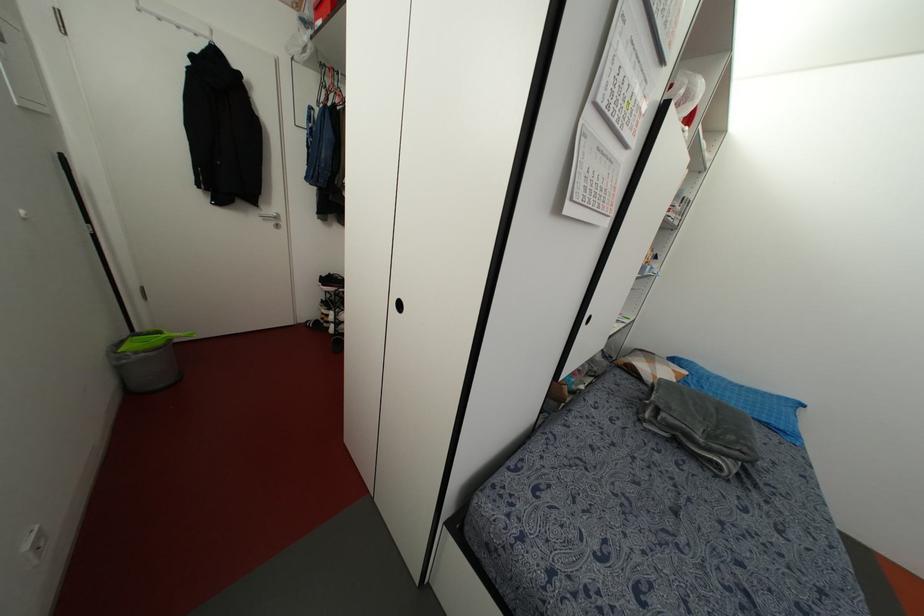
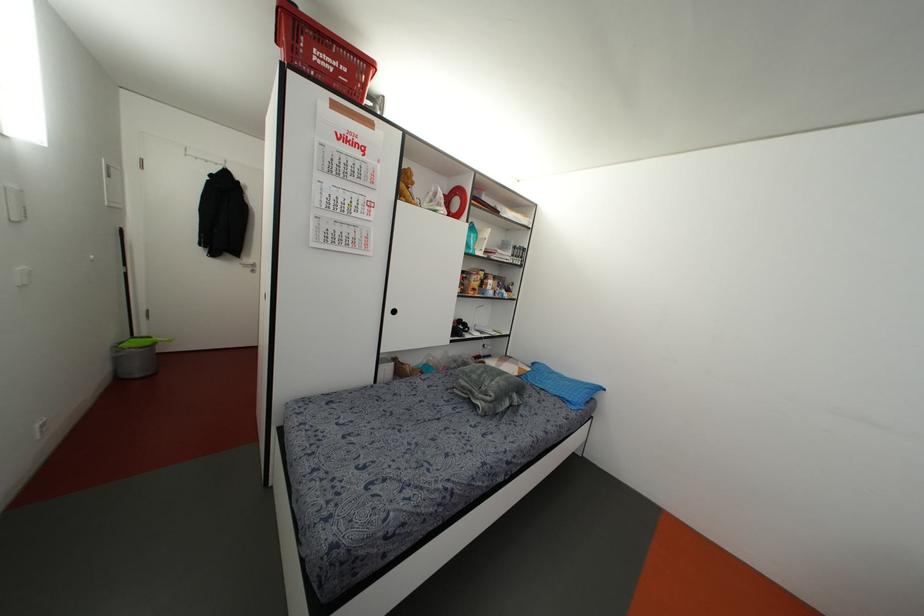
The point at (782, 427) is marked in the first image. Where is the corresponding point in the second image?

(569, 399)